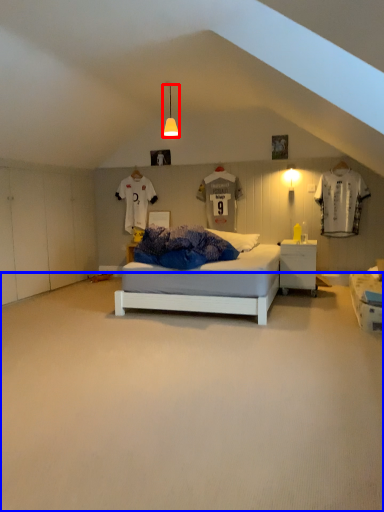
Question: Among these objects, which one is farthest to the camera, light fixture (highlighted by a red box) or plain (highlighted by a blue box)?

Choices:
 (A) light fixture
 (B) plain

Answer: (A)